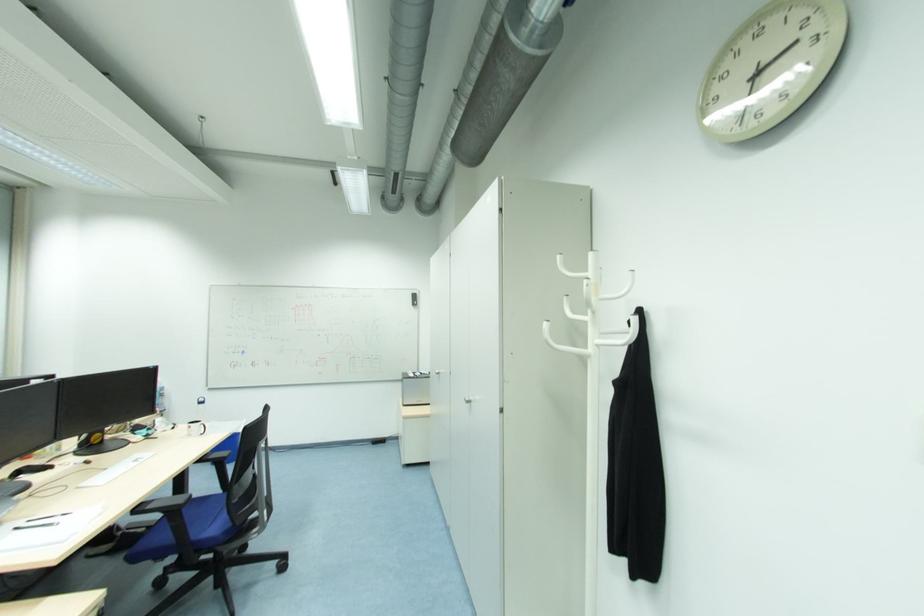
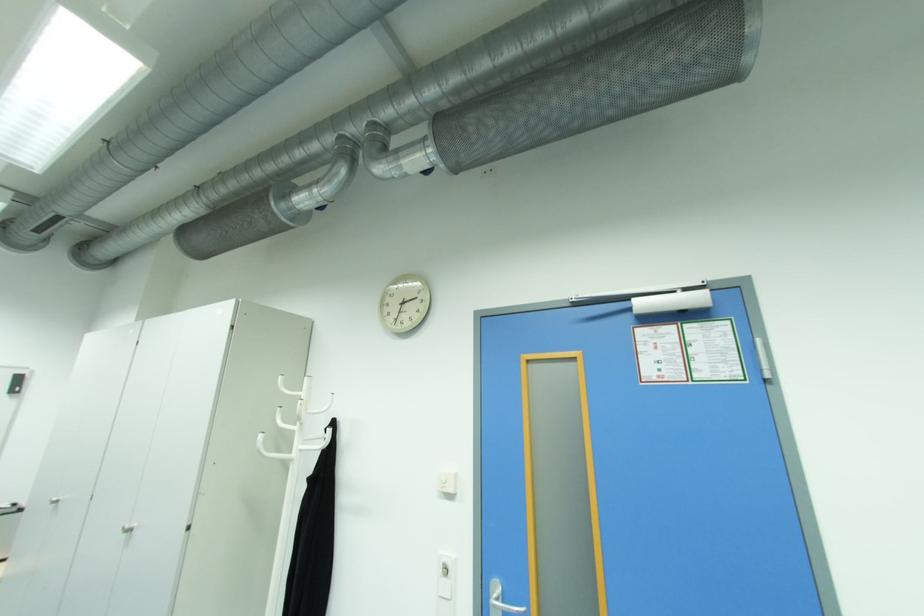
The images are taken continuously from a first-person perspective. In which direction is your viewpoint rotating?

The rotation direction of the camera is right-up.